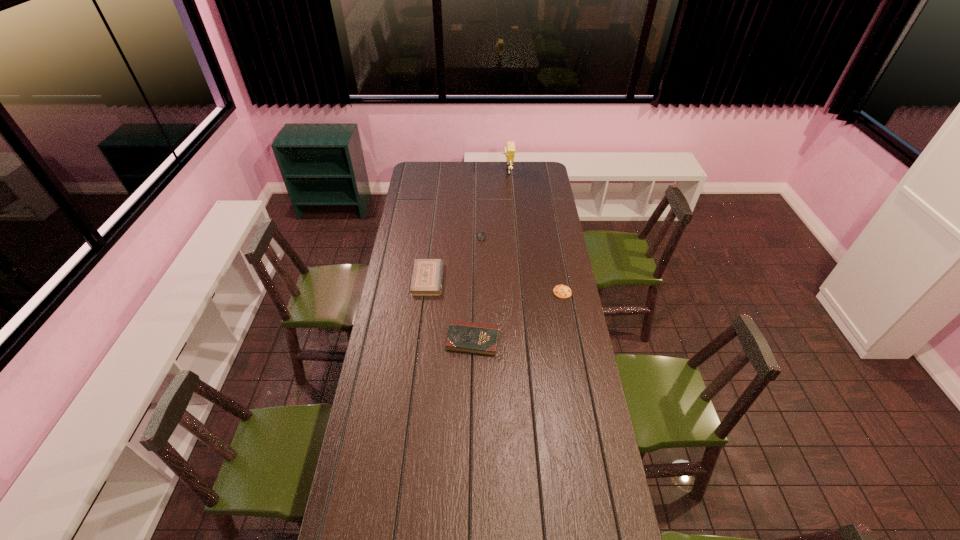
The width and height of the screenshot is (960, 540). I want to click on the tallest object, so click(x=509, y=150).

You are a GUI agent. You are given a task and a screenshot of the screen. Output one action in this format:
    pyautogui.click(x=<x>, y=<y>)
    Task: Click on the sponge
    
    Given the screenshot: What is the action you would take?
    pyautogui.click(x=509, y=150)

You are a GUI agent. You are given a task and a screenshot of the screen. Output one action in this format:
    pyautogui.click(x=<x>, y=<y>)
    Task: Click on the leftmost object
    The height and width of the screenshot is (540, 960).
    Given the screenshot: What is the action you would take?
    pyautogui.click(x=427, y=277)

The width and height of the screenshot is (960, 540). I want to click on the farther Bible, so click(x=427, y=277).

Locate an element on the screen. The height and width of the screenshot is (540, 960). the nearest object is located at coordinates (468, 337).

The image size is (960, 540). Identify the location of the nearer Bible. (468, 337).

Locate an element on the screen. Image resolution: width=960 pixels, height=540 pixels. computer mouse is located at coordinates (481, 235).

Locate an element on the screen. The height and width of the screenshot is (540, 960). the fourth nearest object is located at coordinates (481, 235).

Where is `the rightmost object`? This screenshot has width=960, height=540. the rightmost object is located at coordinates (561, 291).

Where is `cookie`? Image resolution: width=960 pixels, height=540 pixels. cookie is located at coordinates (561, 291).